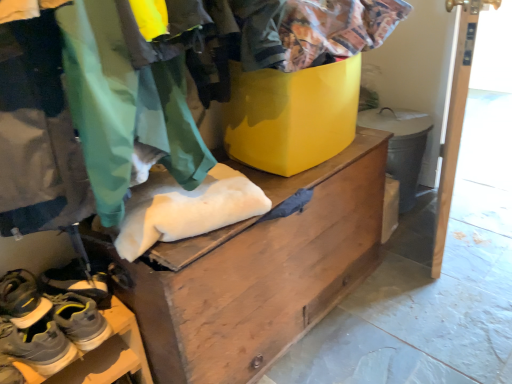
The image size is (512, 384). Identify the location of free space below white wood door at right (from a real-world perspective). (429, 242).